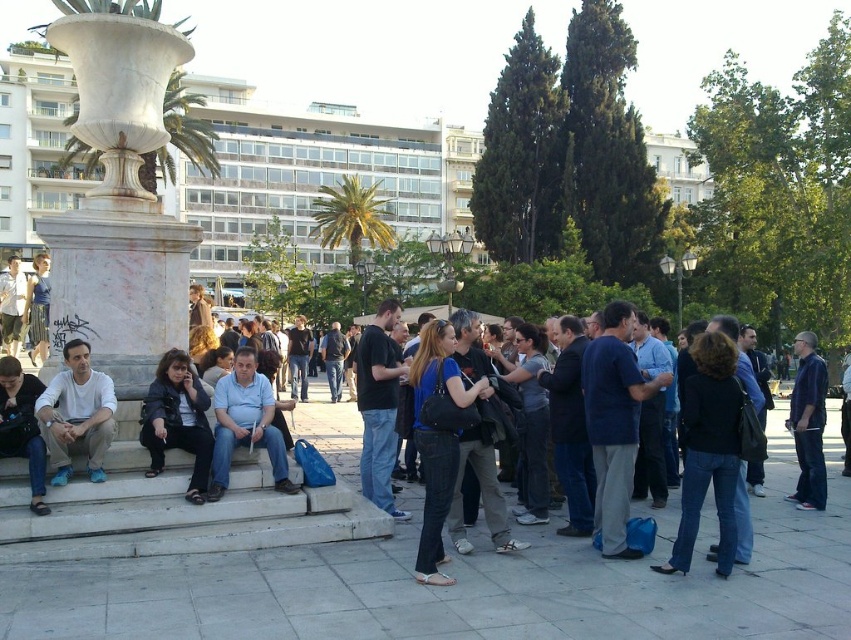
Question: Does blue denim jeans at center appear on the right side of denim jeans at center?

Choices:
 (A) yes
 (B) no

Answer: (B)

Question: Is white marble vase at left bigger than dark blue leather jacket at lower left?

Choices:
 (A) no
 (B) yes

Answer: (B)

Question: Can you confirm if dark blue jeans at center is positioned below dark blue leather jacket at lower left?

Choices:
 (A) yes
 (B) no

Answer: (A)

Question: Which object appears closest to the camera in this image?

Choices:
 (A) denim jeans at center
 (B) dark blue jeans at center
 (C) dark blue leather jacket at lower left

Answer: (B)

Question: Among these objects, which one is nearest to the camera?

Choices:
 (A) white marble vase at left
 (B) dark blue leather jacket at lower left

Answer: (B)

Question: Which of the following is the closest to the observer?

Choices:
 (A) (427, 524)
 (B) (63, 404)

Answer: (A)